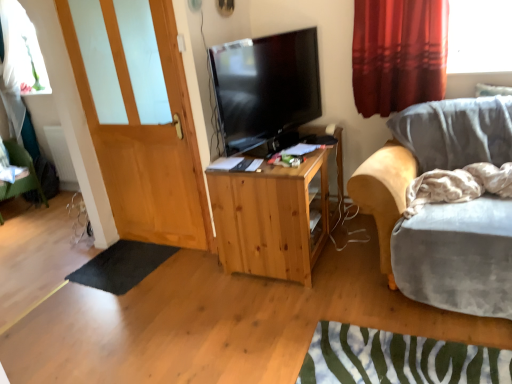
Question: Would you say natural wood cabinet at center is inside or outside velvet grey chair at right?

Choices:
 (A) inside
 (B) outside

Answer: (B)

Question: From a real-world perspective, relative to velvet grey chair at right, is natural wood cabinet at center vertically above or below?

Choices:
 (A) above
 (B) below

Answer: (B)

Question: Which of these objects is positioned closest to the velvet grey chair at right?

Choices:
 (A) natural wood cabinet at center
 (B) white fabric pillow at upper right
 (C) white matte radiator at lower left
 (D) black rubber mat at lower left
 (E) green fabric chair at lower left

Answer: (A)

Question: Considering the real-world distances, which object is farthest from the wooden door at left?

Choices:
 (A) green fabric chair at lower left
 (B) beige textured blanket at right
 (C) black glossy tv at center
 (D) white matte radiator at lower left
 (E) red velvet curtain at upper right

Answer: (A)